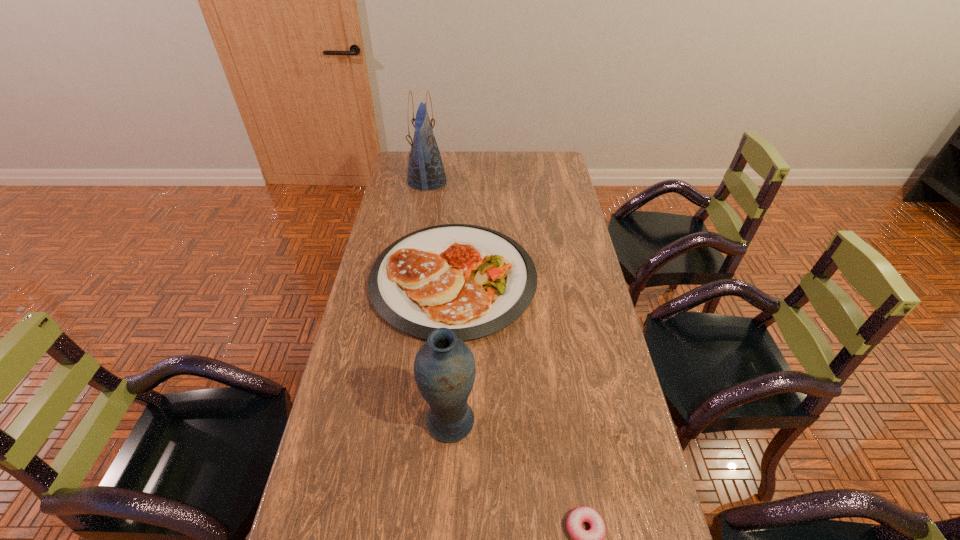
Locate an element on the screen. The height and width of the screenshot is (540, 960). dish that is positioned at the left edge is located at coordinates (476, 281).

Find the location of a particular element. object located in the far left corner section of the desktop is located at coordinates (426, 171).

Identify the location of free space at the left edge of the desktop. (390, 358).

What are the coordinates of `free region at the right edge of the desktop` in the screenshot? It's located at (592, 332).

Where is `object that is the closest one to the second tallest object`? Image resolution: width=960 pixels, height=540 pixels. object that is the closest one to the second tallest object is located at coordinates (476, 281).

The width and height of the screenshot is (960, 540). In order to click on object that stands as the second closest to the dish in this screenshot , I will do `click(426, 171)`.

Find the location of a particular element. The width and height of the screenshot is (960, 540). vacant position in the image that satisfies the following two spatial constraints: 1. on the front side of the shopping bag; 2. on the right side of the third shortest object is located at coordinates (388, 422).